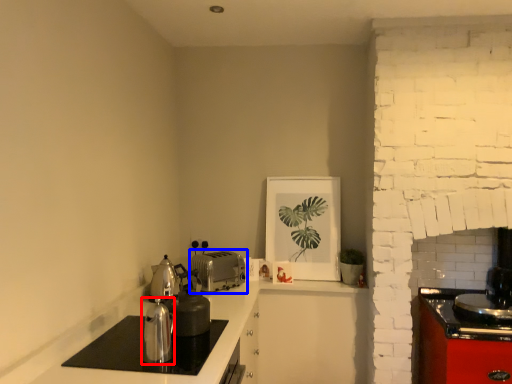
Question: Which point is closer to the camera, kitchen appliance (highlighted by a red box) or toaster (highlighted by a blue box)?

Choices:
 (A) kitchen appliance
 (B) toaster

Answer: (A)